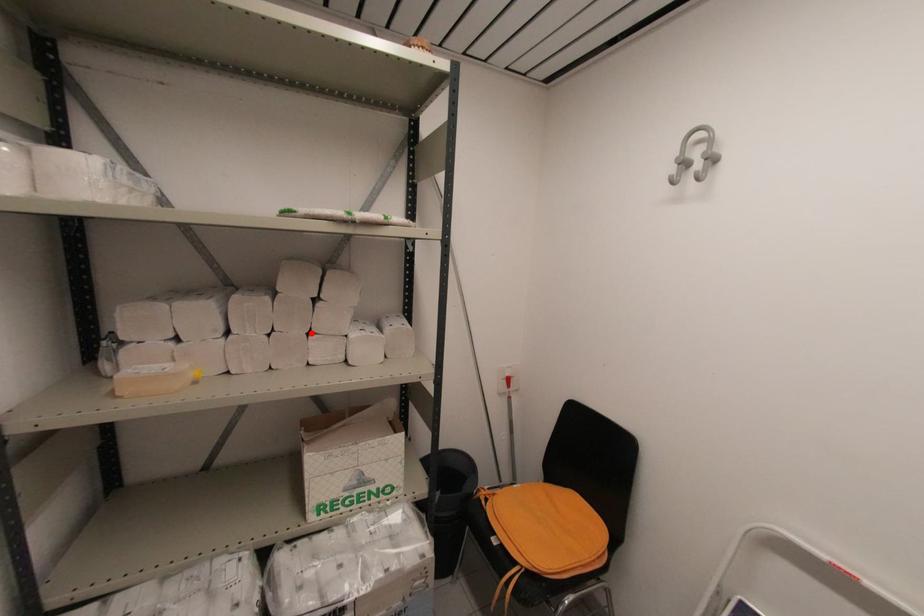
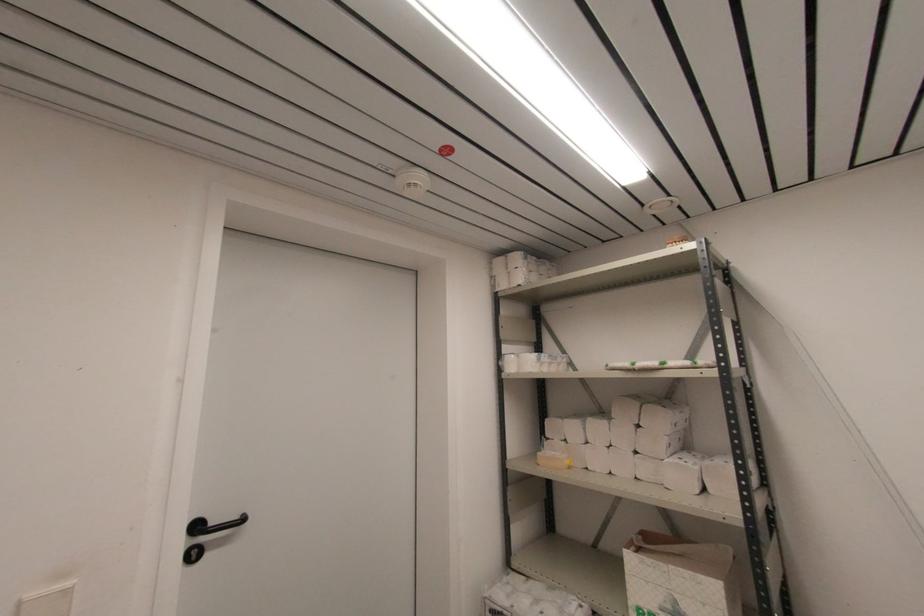
The point at the highlighted location is marked in the first image. Where is the corresponding point in the second image?

(637, 453)